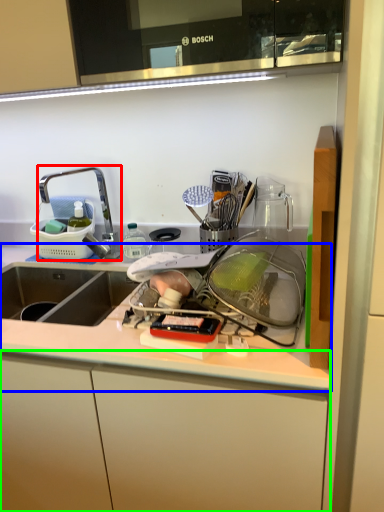
Question: Which is nearer to the tap (highlighted by a red box)? countertop (highlighted by a blue box) or cabinetry (highlighted by a green box).

Choices:
 (A) countertop
 (B) cabinetry

Answer: (A)